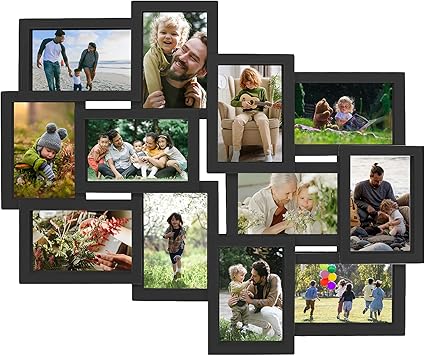
Identify the location of top row of photos. (255, 106), (347, 103), (181, 61), (92, 65).